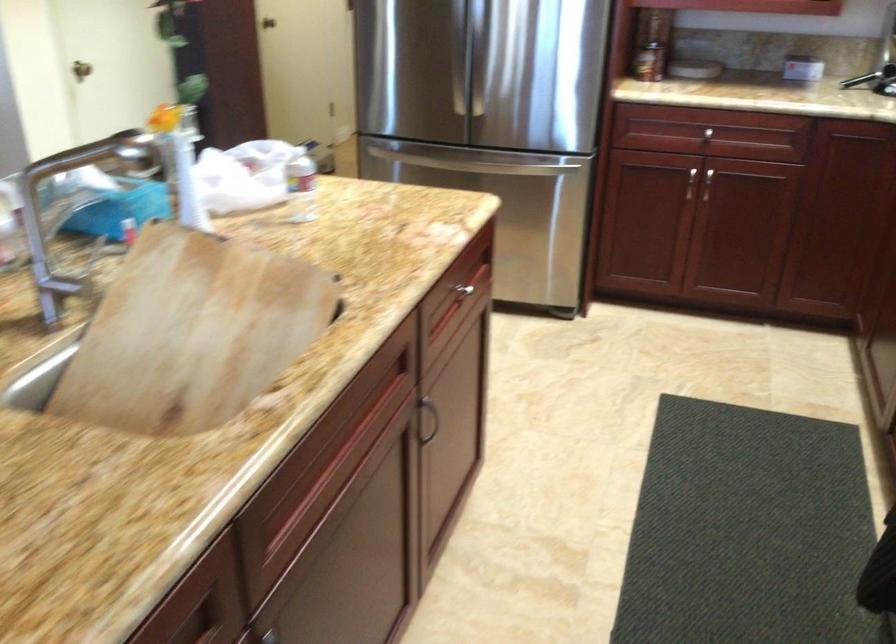
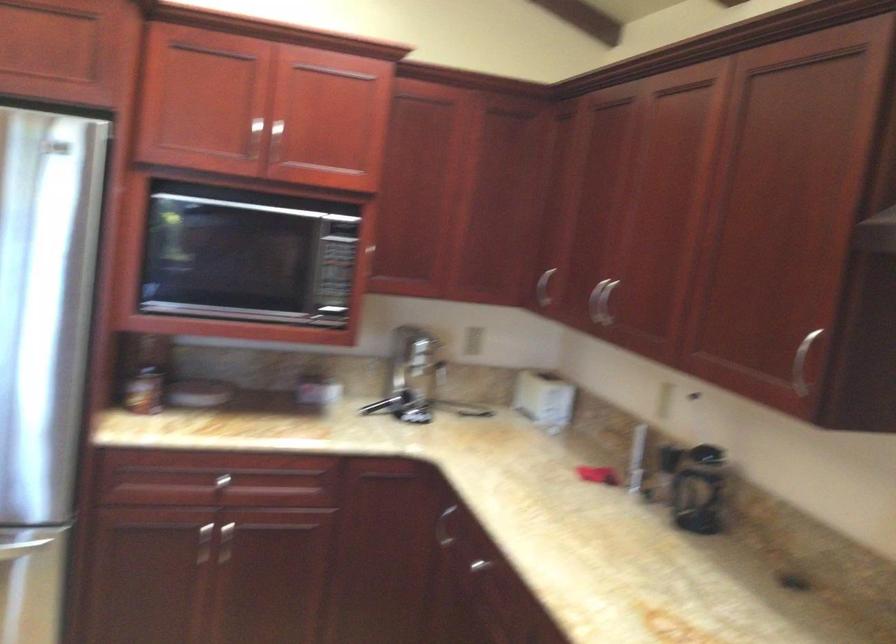
Locate, in the second image, the point that corresponds to pixel 685 182 in the first image.

(203, 544)